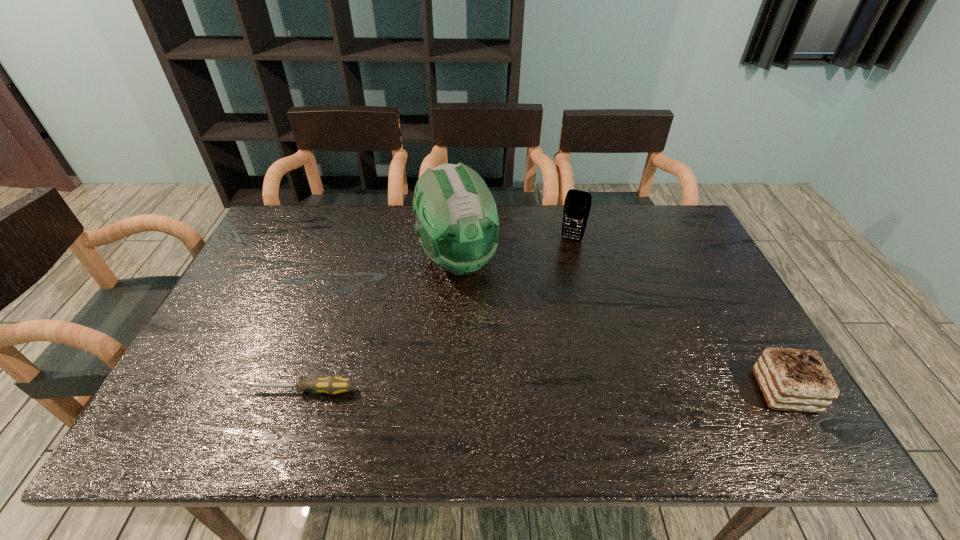
The height and width of the screenshot is (540, 960). Find the location of `the leftmost object`. the leftmost object is located at coordinates (332, 385).

I want to click on the shortest object, so click(x=332, y=385).

What are the coordinates of `the third tallest object` in the screenshot? It's located at (797, 380).

At what (x,y) coordinates should I click in order to perform the action: click on the rightmost object. Please return your answer as a coordinate pair (x, y). This screenshot has height=540, width=960. Looking at the image, I should click on (797, 380).

The height and width of the screenshot is (540, 960). What are the coordinates of `cellular telephone` in the screenshot? It's located at (577, 204).

The image size is (960, 540). I want to click on the second tallest object, so click(577, 204).

Find the location of `the second object from left to right`. the second object from left to right is located at coordinates point(457,222).

Find the location of a particular element. the tallest object is located at coordinates (457, 222).

What are the coordinates of `vacant space located at the tip of the leftmost object` in the screenshot? It's located at (220, 390).

Locate an element on the screen. The image size is (960, 540). vacant space located at the tip of the leftmost object is located at coordinates (203, 390).